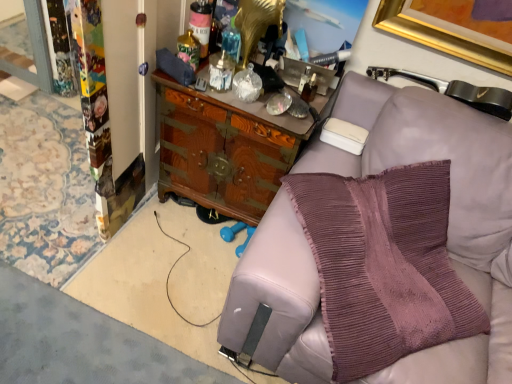
Identify the location of vacant area that is in front of wooden cabinet at center. This screenshot has width=512, height=384. (173, 264).